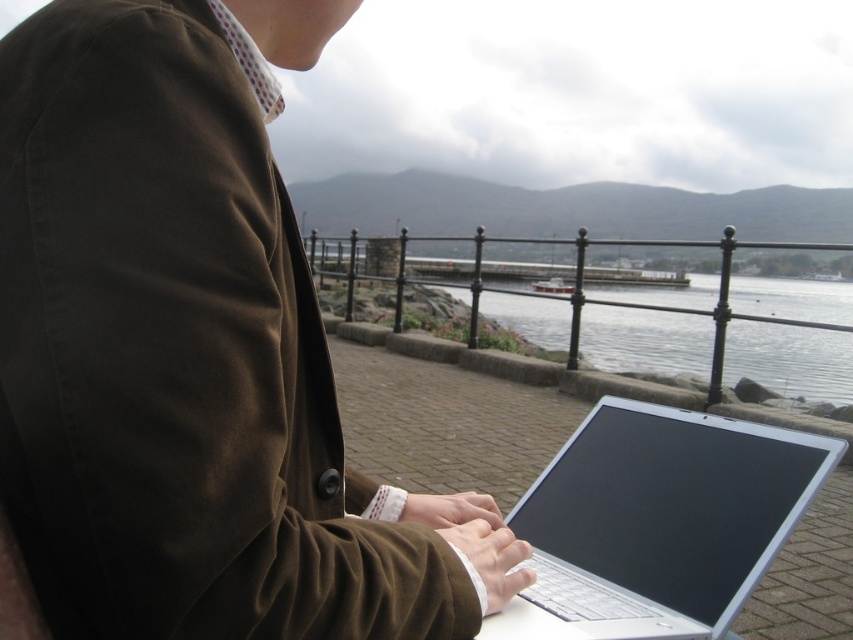
Question: Is silver metallic laptop at center behind clear water at center?

Choices:
 (A) no
 (B) yes

Answer: (A)

Question: Is brown cotton jacket at center closer to camera compared to clear water at center?

Choices:
 (A) no
 (B) yes

Answer: (B)

Question: Which object appears closest to the camera in this image?

Choices:
 (A) clear water at center
 (B) brown cotton jacket at center
 (C) silver metallic laptop at center

Answer: (B)

Question: Which point is closer to the camera?

Choices:
 (A) pos(281,32)
 (B) pos(838,308)

Answer: (A)

Question: Among these objects, which one is nearest to the camera?

Choices:
 (A) silver metallic laptop at center
 (B) brown cotton jacket at center

Answer: (B)

Question: Is brown cotton jacket at center positioned behind clear water at center?

Choices:
 (A) no
 (B) yes

Answer: (A)